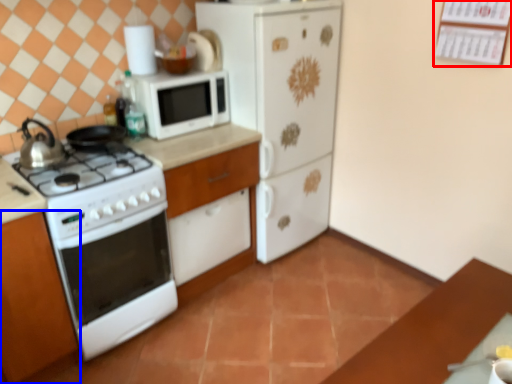
Question: Among these objects, which one is farthest to the camera, bulletin board (highlighted by a red box) or cabinetry (highlighted by a blue box)?

Choices:
 (A) bulletin board
 (B) cabinetry

Answer: (A)